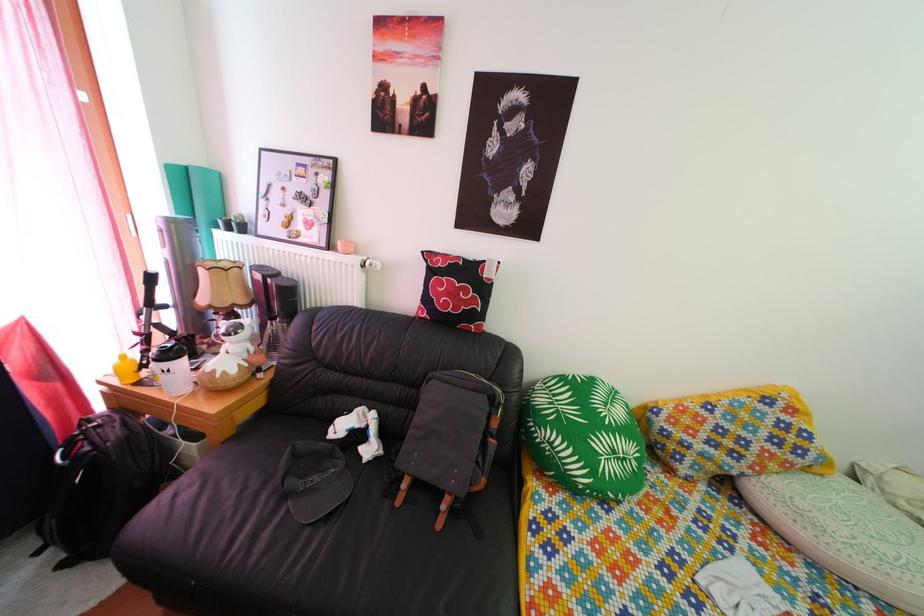
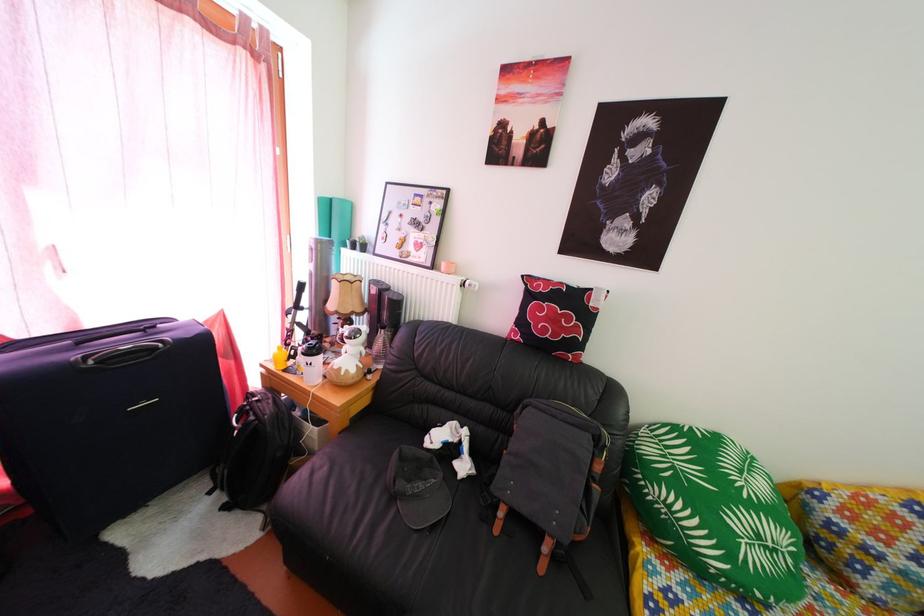
Find the pixel in the second image that matches point 492,376 in the first image.

(591, 410)